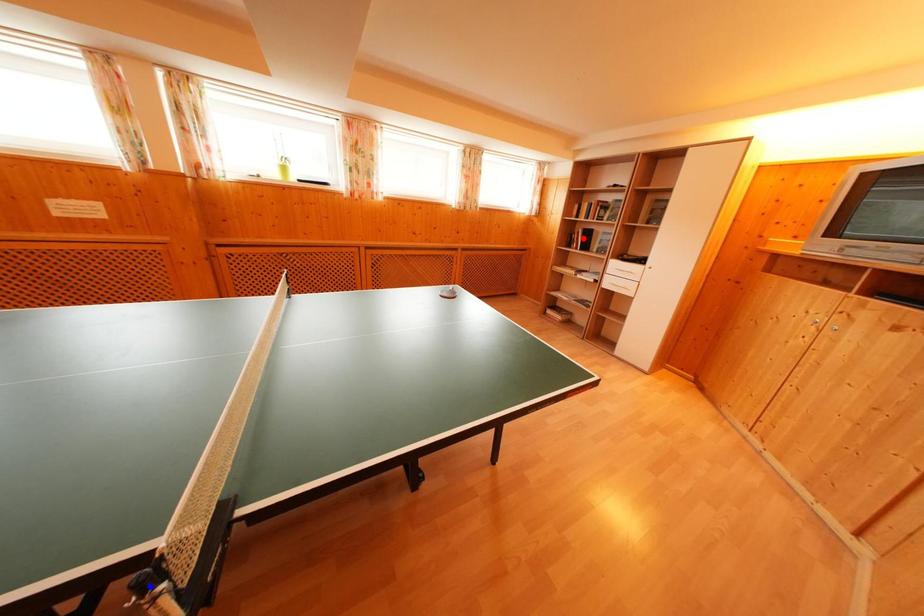
Question: In the image, two points are highlighted. Which point is nearer to the camera? Reply with the corresponding letter.

Choices:
 (A) blue point
 (B) red point

Answer: (A)